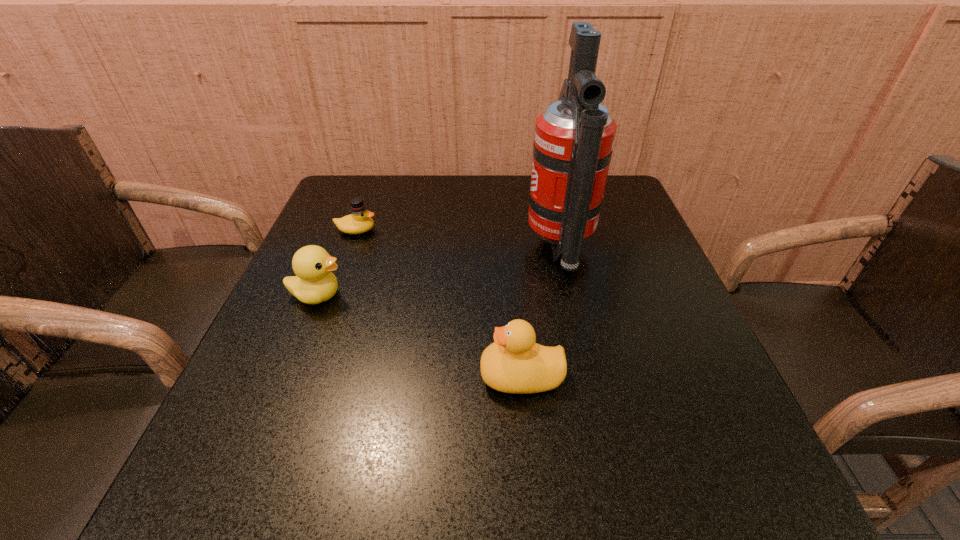
This screenshot has height=540, width=960. In the image, there is a desktop. In order to click on vacant space at the right edge in this screenshot , I will do click(660, 343).

Image resolution: width=960 pixels, height=540 pixels. What are the coordinates of `free space at the far left corner of the desktop` in the screenshot? It's located at (381, 178).

The width and height of the screenshot is (960, 540). Find the location of `vacant space at the near left corner of the desktop`. vacant space at the near left corner of the desktop is located at coordinates (214, 492).

Find the location of `blank space at the far right corner`. blank space at the far right corner is located at coordinates (606, 198).

This screenshot has height=540, width=960. I want to click on vacant area that lies between the second farthest duck and the shortest object, so click(337, 262).

I want to click on blank region between the nearest object and the fire extinguisher, so pyautogui.click(x=540, y=312).

The width and height of the screenshot is (960, 540). Identify the location of free spot between the nearest object and the shortest duck. (439, 303).

Where is `free space between the second nearest duck and the shortest duck`? free space between the second nearest duck and the shortest duck is located at coordinates (337, 262).

Locate an element on the screen. The width and height of the screenshot is (960, 540). vacant region between the shortest duck and the second nearest duck is located at coordinates (337, 262).

Where is `free space between the shortest duck and the fire extinguisher`? free space between the shortest duck and the fire extinguisher is located at coordinates (458, 239).